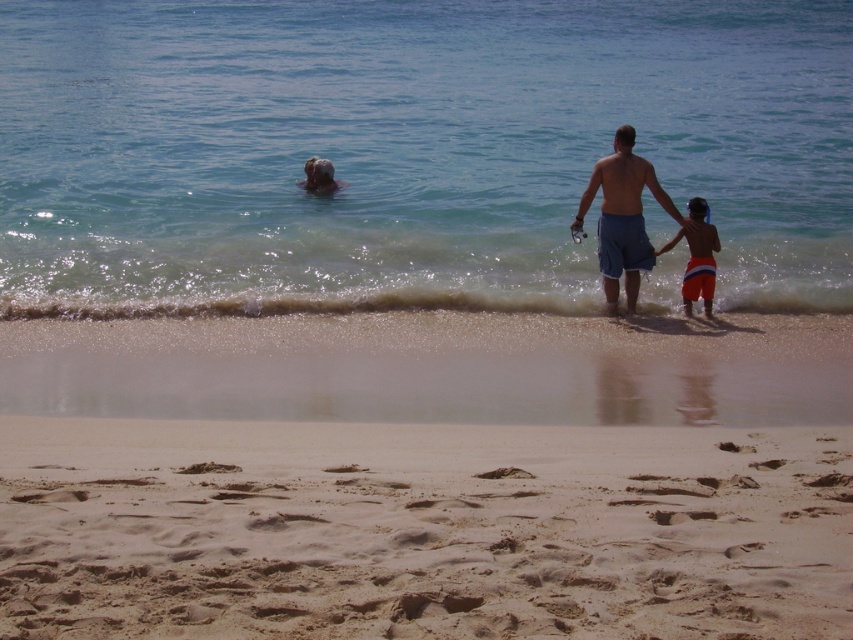
In the scene shown: You are a photographer standing on the beach and want to capture both the blue denim shorts at center and the orange striped shorts at right in a single shot. Which of the two shorts is closer to the camera?

The blue denim shorts at center is positioned over orange striped shorts at right, so it is closer to the camera.